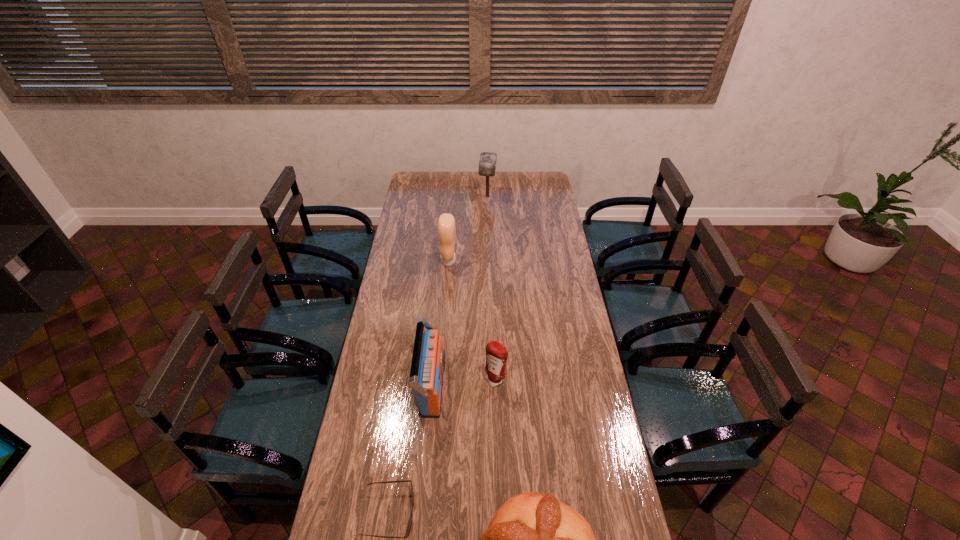
Image resolution: width=960 pixels, height=540 pixels. Find the location of `free space between the mallet and the second farthest object`. free space between the mallet and the second farthest object is located at coordinates (468, 229).

The image size is (960, 540). I want to click on vacant area that lies between the second farthest object and the farthest object, so click(468, 229).

Identify which object is located as the third nearest to the fifth nearest object. Please provide its 2D coordinates. Your answer should be formatted as a tuple, i.e. [(x, y)], where the tuple contains the x and y coordinates of a point satisfying the conditions above.

[(496, 354)]

Select which object appears as the second closest to the radio receiver. Please provide its 2D coordinates. Your answer should be formatted as a tuple, i.e. [(x, y)], where the tuple contains the x and y coordinates of a point satisfying the conditions above.

[(409, 526)]

Where is `vacant space that satisfies the following two spatial constraints: 1. on the label of the fourth tallest object; 2. on the left side of the left condiment`? vacant space that satisfies the following two spatial constraints: 1. on the label of the fourth tallest object; 2. on the left side of the left condiment is located at coordinates (440, 380).

The image size is (960, 540). I want to click on vacant space that satisfies the following two spatial constraints: 1. on the front side of the mallet; 2. on the front-facing side of the radio receiver, so click(x=492, y=387).